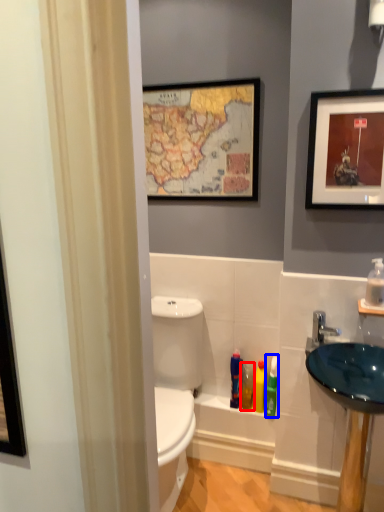
Question: Which object appears farthest to the camera in this image, toiletry (highlighted by a red box) or toiletry (highlighted by a blue box)?

Choices:
 (A) toiletry
 (B) toiletry

Answer: (A)